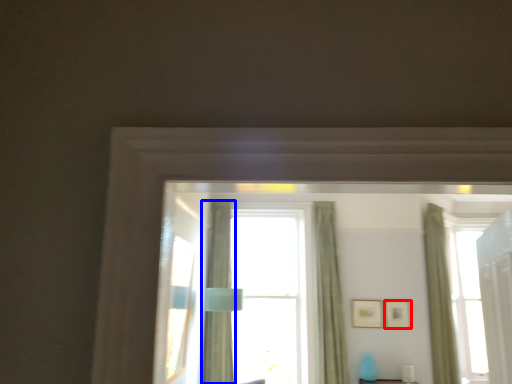
Question: Which point is further to the camera, picture frame (highlighted by a red box) or curtain (highlighted by a blue box)?

Choices:
 (A) picture frame
 (B) curtain

Answer: (A)